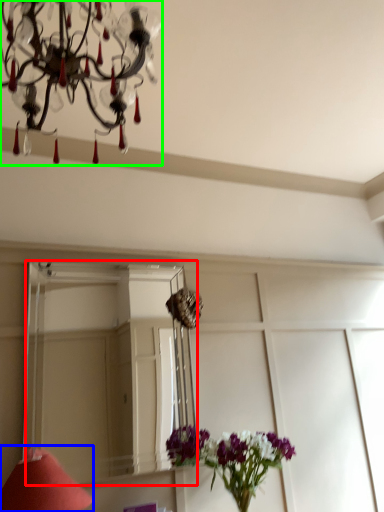
Question: Which object is positioned closest to mirror (highlighted by a red box)? Select from table lamp (highlighted by a blue box) and lamp (highlighted by a green box).

Choices:
 (A) table lamp
 (B) lamp

Answer: (A)